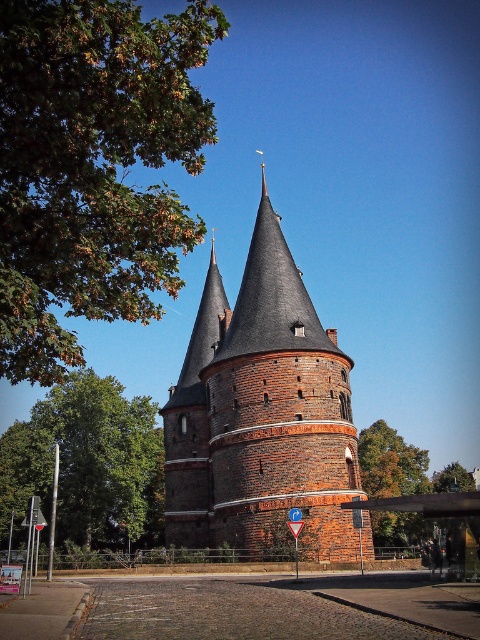
Question: Which point is farther to the camera?

Choices:
 (A) (247, 387)
 (B) (27, 529)
 (C) (377, 433)
 (D) (159, 493)

Answer: (C)

Question: Can you confirm if brick tower at center is positioned to the right of green leafy tree at center?

Choices:
 (A) yes
 (B) no

Answer: (B)

Question: Does brick tower at center have a larger size compared to green leafy tree at left?

Choices:
 (A) yes
 (B) no

Answer: (A)

Question: Can you confirm if green leafy tree at upper left is positioned above metallic street sign at lower left?

Choices:
 (A) no
 (B) yes

Answer: (B)

Question: Which object appears closest to the camera in this image?

Choices:
 (A) green leafy tree at upper left
 (B) green leafy tree at left
 (C) brick tower at center
 (D) metallic street sign at lower left

Answer: (A)

Question: Which of the following is the farthest from the observer?

Choices:
 (A) (190, 67)
 (B) (372, 516)

Answer: (B)